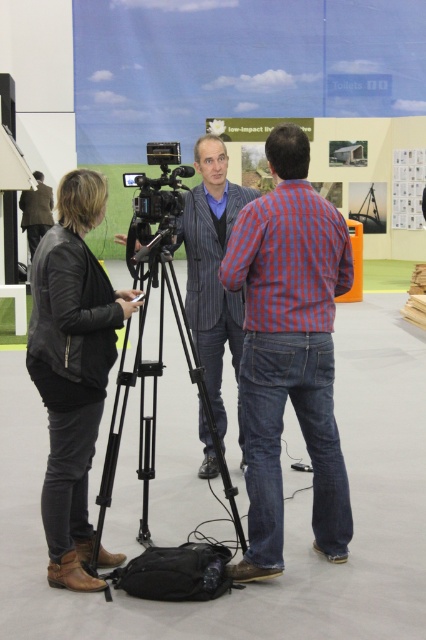
You are a photographer setting up for a photo shoot in the conference hall. You need to ensure that the red checkered shirt at center and the black plastic video camera at center are both visible in your shot. Given their sizes, which object should you focus on to frame both properly?

The red checkered shirt at center is much taller than the black plastic video camera at center, so you should focus on framing the taller red checkered shirt at center to ensure both objects are visible.